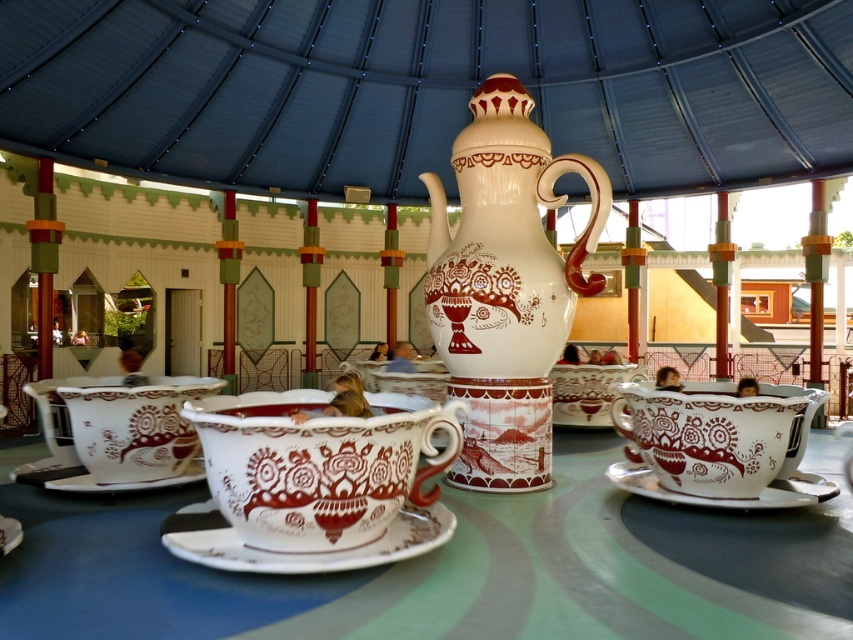
Looking at this image, you are a visitor at the fairground and want to place a decorative ring around both the white glossy teacup at lower right and the white ceramic saucer at center. Which object requires a larger ring to fit around it?

The white glossy teacup at lower right requires a larger ring because it might be wider than the white ceramic saucer at center.

You are a guest at the amusement park and want to place a small toy on the white ceramic saucer at center. However, there is a white glossy teacup at lower right in the way. Can you move the toy to the saucer without touching the cup?

The white glossy teacup at lower right is above the white ceramic saucer at center, so you can move the toy to the saucer by placing it underneath the cup without touching the cup.